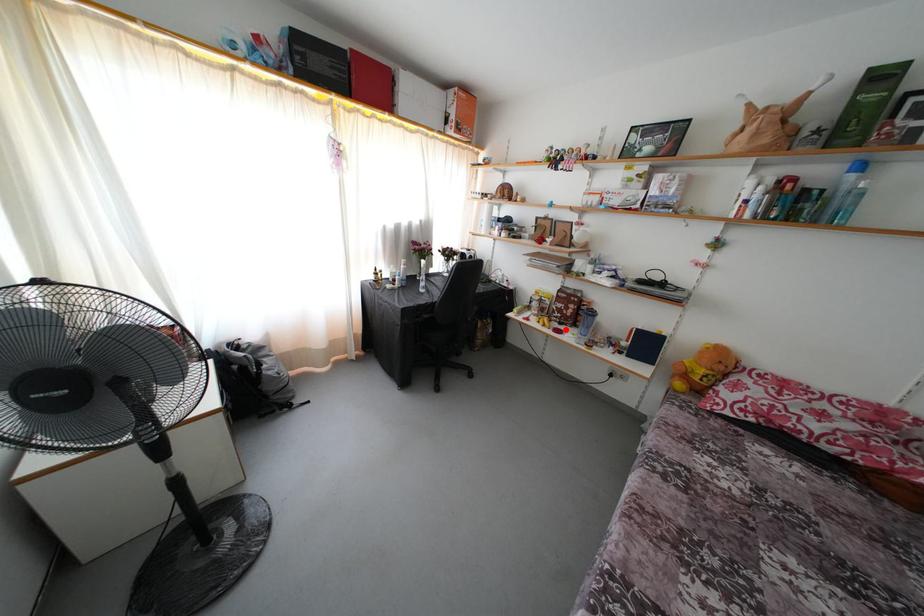
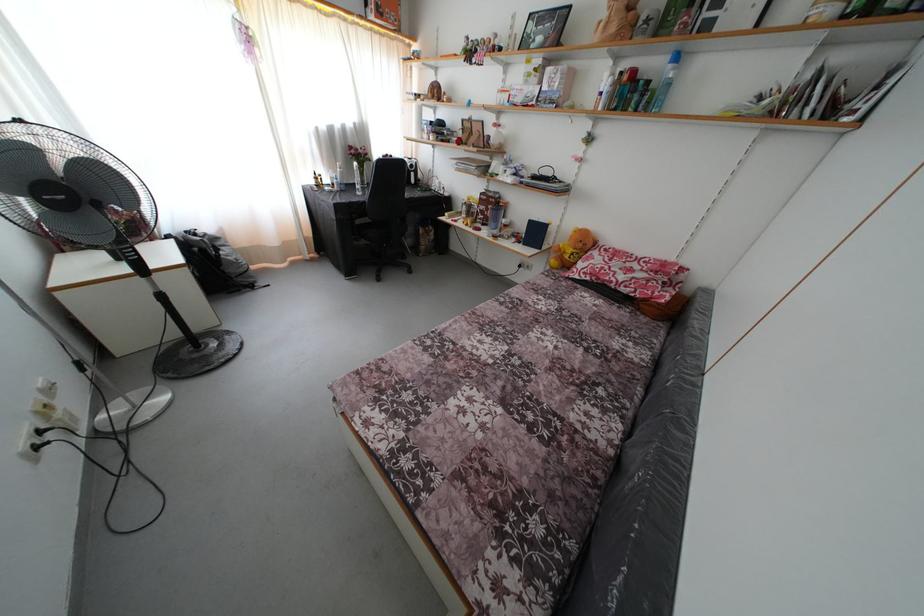
Find the pixel in the second image that matches the highlighted location in the first image.

(488, 230)